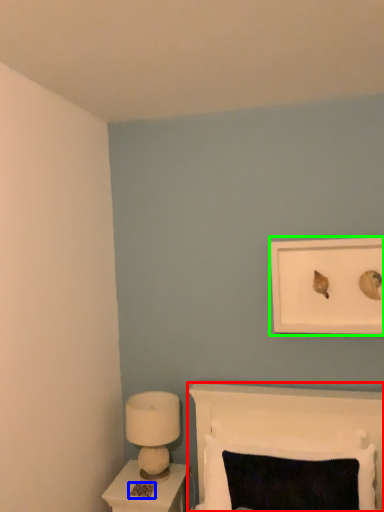
Question: Which object is positioned closest to furniture (highlighted by a red box)? Select from footprint (highlighted by a blue box) and picture frame (highlighted by a green box).

Choices:
 (A) footprint
 (B) picture frame

Answer: (B)